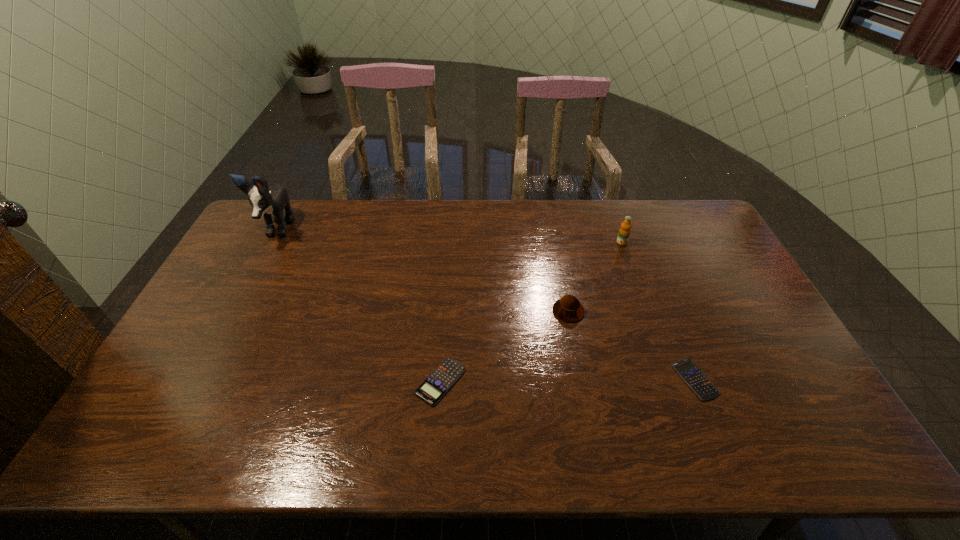
Locate an element on the screen. This screenshot has width=960, height=540. vacant space at the far right corner of the desktop is located at coordinates (676, 205).

This screenshot has width=960, height=540. In order to click on vacant space that's between the muffin and the second tallest object in this screenshot , I will do `click(595, 277)`.

The width and height of the screenshot is (960, 540). I want to click on free spot between the fourth shortest object and the puppy, so click(x=449, y=237).

The image size is (960, 540). In order to click on free space between the shorter calculator and the puppy in this screenshot , I will do (x=486, y=305).

Find the location of a particular element. This screenshot has width=960, height=540. free space between the fourth object from right to left and the tallest object is located at coordinates (358, 306).

Locate an element on the screen. The height and width of the screenshot is (540, 960). free space between the fourth tallest object and the shorter calculator is located at coordinates (567, 380).

Locate an element on the screen. free spot between the tallest object and the fourth tallest object is located at coordinates (358, 306).

Locate an element on the screen. This screenshot has height=540, width=960. free space between the orange juice and the shorter calculator is located at coordinates (659, 311).

The width and height of the screenshot is (960, 540). I want to click on vacant space that is in between the left calculator and the muffin, so click(x=504, y=346).

Locate an element on the screen. The image size is (960, 540). empty space between the taller calculator and the second tallest object is located at coordinates (531, 312).